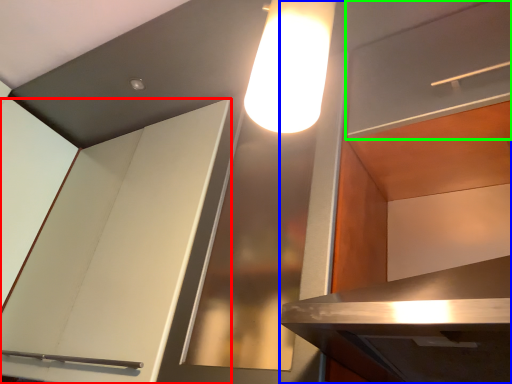
Question: Estimate the real-world distances between objects in this image. Which object is farther from cabinetry (highlighted by a red box), cabinetry (highlighted by a blue box) or shelf (highlighted by a green box)?

Choices:
 (A) cabinetry
 (B) shelf

Answer: (B)